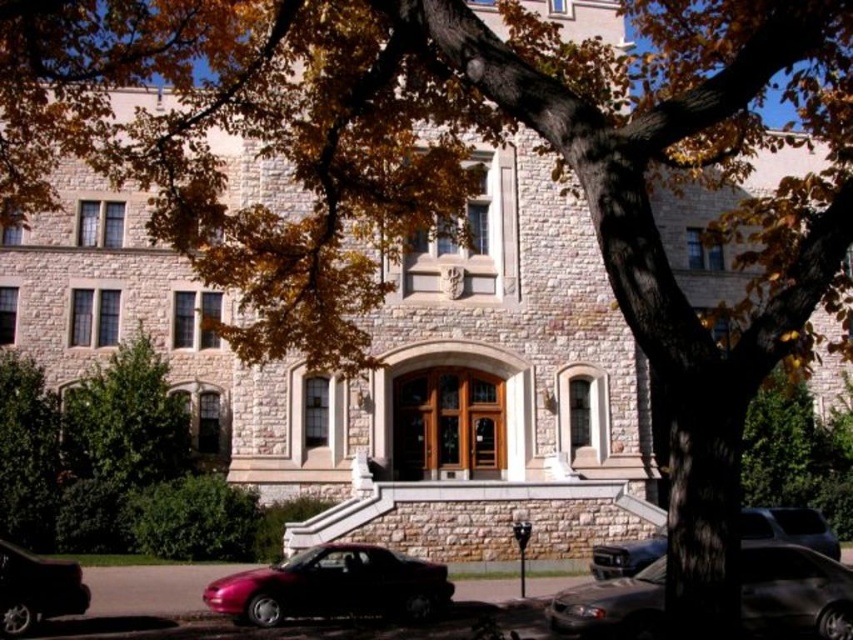
You are a pedestrian standing in front of the building and want to cross the road to reach the entrance. There are two cars parked near the curb. Which car, the shiny black car at lower left or the metallic silver sedan at lower right, is blocking your path more directly?

The shiny black car at lower left is positioned under metallic silver sedan at lower right, so the metallic silver sedan at lower right is higher up and might be less obstructive, while the shiny black car at lower left is closer to the road and thus blocking the path more directly.

You are a delivery driver who needs to park your truck, which is 2 meters wide, in the parking area near the shiny black sedan at lower right and metallic silver sedan at lower right. Can you fit your truck between them?

The shiny black sedan at lower right is narrower than the metallic silver sedan at lower right. However, without knowing the exact distance between them, it is impossible to determine if the truck can fit. Please check the available space between the two sedans.

You are driving a car and want to exit the parking lot near the building. You see the shiny black car at lower left and the metallic silver sedan at lower right. Which car is blocking your path if you want to leave?

The metallic silver sedan at lower right is behind the shiny black car at lower left, so the shiny black car at lower left is blocking your path.